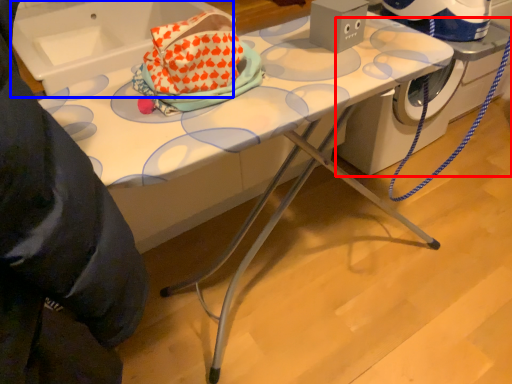
Question: Which object is further to the camera taking this photo, machine (highlighted by a red box) or sink (highlighted by a blue box)?

Choices:
 (A) machine
 (B) sink

Answer: (A)